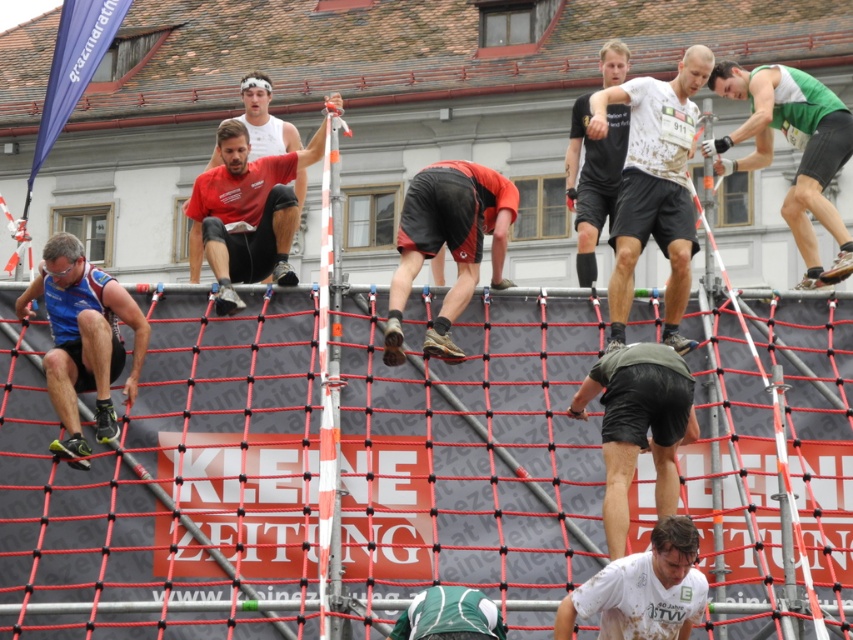
Does matte red shirt at upper center have a greater height compared to white cotton shirt at center?

Indeed, matte red shirt at upper center has a greater height compared to white cotton shirt at center.

Does matte red shirt at upper center have a smaller size compared to white cotton shirt at center?

Actually, matte red shirt at upper center might be larger than white cotton shirt at center.

Which is behind, point (287, 202) or point (683, 531)?

Point (287, 202)

Where is `matte red shirt at upper center`? This screenshot has width=853, height=640. matte red shirt at upper center is located at coordinates (247, 212).

Is orange fabric shorts at center wider than green matte shorts at center?

Correct, the width of orange fabric shorts at center exceeds that of green matte shorts at center.

Is point (492, 202) positioned after point (643, 356)?

Yes, point (492, 202) is farther from viewer.

You are a GUI agent. You are given a task and a screenshot of the screen. Output one action in this format:
    pyautogui.click(x=<x>, y=<y>)
    Task: Click on the orange fabric shorts at center
    
    Given the screenshot: What is the action you would take?
    pyautogui.click(x=447, y=243)

Is blue matte vest at left smaller than green matte tank top at upper right?

Yes.

Between point (73, 321) and point (769, 70), which one is positioned in front?

Point (73, 321)

The image size is (853, 640). What are the coordinates of `blue matte vest at left` in the screenshot? It's located at (83, 340).